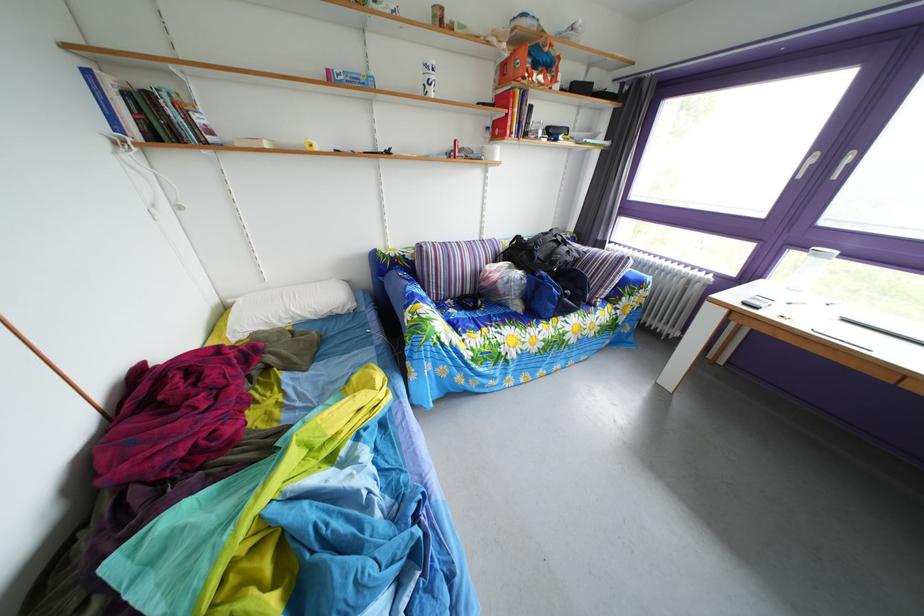
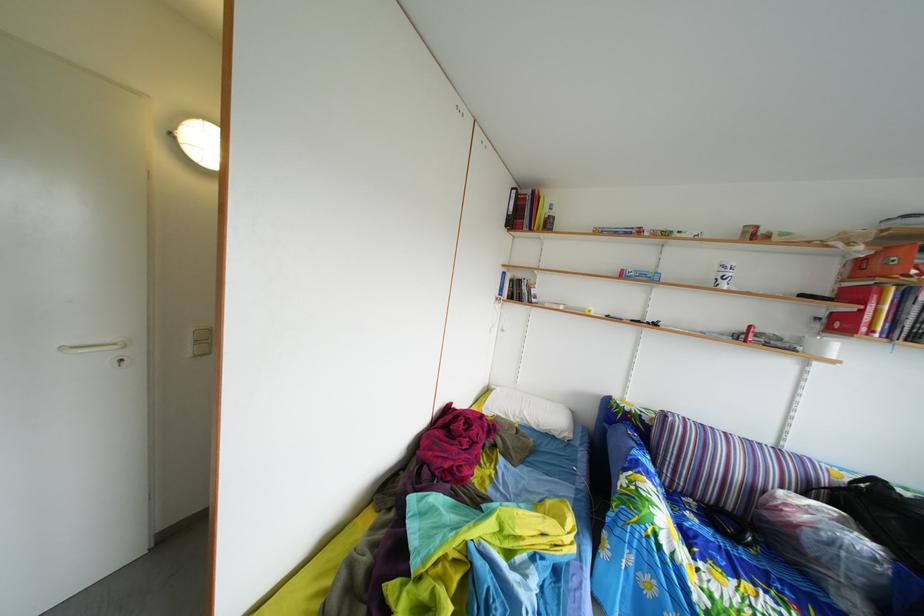
Locate, in the second image, the point that corresponds to point (432, 79) in the first image.

(727, 276)